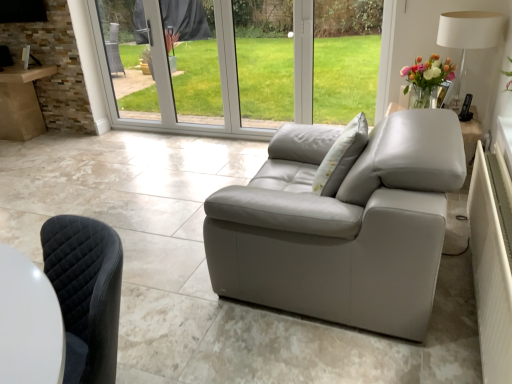
Question: From the image's perspective, is white fabric lampshade at upper right located above or below light gray fabric pillow at center?

Choices:
 (A) below
 (B) above

Answer: (B)

Question: Would you say white fabric lampshade at upper right is to the left or to the right of light gray fabric pillow at center in the picture?

Choices:
 (A) left
 (B) right

Answer: (B)

Question: Is white fabric lampshade at upper right wider or thinner than light gray fabric pillow at center?

Choices:
 (A) wide
 (B) thin

Answer: (A)

Question: In terms of size, does light gray fabric pillow at center appear bigger or smaller than white fabric lampshade at upper right?

Choices:
 (A) small
 (B) big

Answer: (A)

Question: Which is correct: light gray fabric pillow at center is inside white fabric lampshade at upper right, or outside of it?

Choices:
 (A) outside
 (B) inside

Answer: (A)

Question: Is point (332, 188) positioned closer to the camera than point (481, 39)?

Choices:
 (A) farther
 (B) closer

Answer: (B)

Question: From their relative heights in the image, would you say light gray fabric pillow at center is taller or shorter than white fabric lampshade at upper right?

Choices:
 (A) tall
 (B) short

Answer: (B)